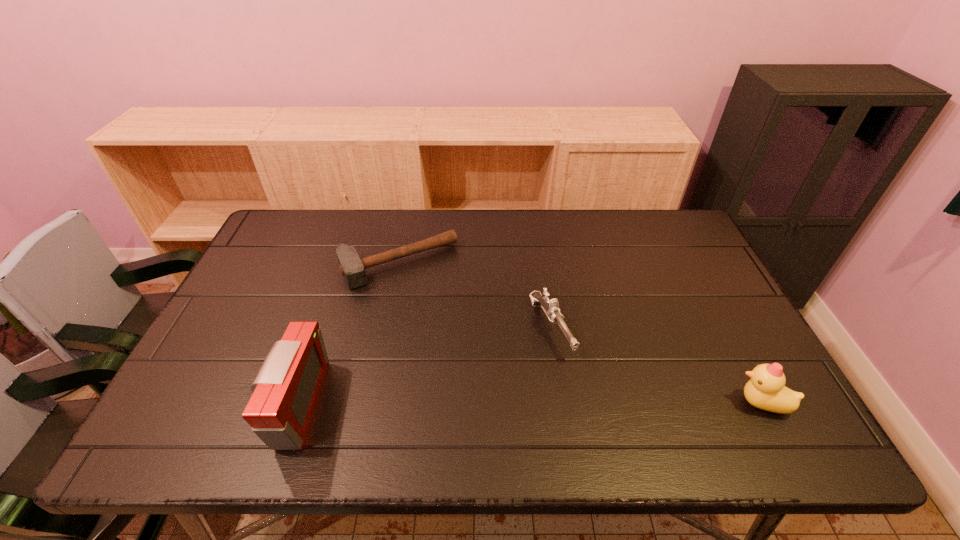
Identify the location of free space that is in between the camera and the third tallest object. This screenshot has width=960, height=540. (424, 366).

You are a GUI agent. You are given a task and a screenshot of the screen. Output one action in this format:
    pyautogui.click(x=<x>, y=<y>)
    Task: Click on the unoccupied area between the third tallest object and the camera
    
    Given the screenshot: What is the action you would take?
    pyautogui.click(x=424, y=366)

At what (x,y) coordinates should I click in order to perform the action: click on vacant area between the farthest object and the second object from right to left. Please return your answer as a coordinate pair (x, y). Looking at the image, I should click on (x=475, y=296).

Identify the location of free space between the camera and the rightmost object. The height and width of the screenshot is (540, 960). (530, 403).

Identify the location of vacant space in between the duckling and the farthest object. [x=581, y=334].

The height and width of the screenshot is (540, 960). I want to click on free space between the second shortest object and the duckling, so click(656, 366).

You are a GUI agent. You are given a task and a screenshot of the screen. Output one action in this format:
    pyautogui.click(x=<x>, y=<y>)
    Task: Click on the empty location between the rightmost object and the camera
    This screenshot has height=540, width=960.
    Given the screenshot: What is the action you would take?
    pyautogui.click(x=530, y=403)

Point out which object is positioned as the third nearest to the second object from right to left. Please provide its 2D coordinates. Your answer should be formatted as a tuple, i.e. [(x, y)], where the tuple contains the x and y coordinates of a point satisfying the conditions above.

[(286, 390)]

Identify which object is located as the nearest to the second object from right to left. Please provide its 2D coordinates. Your answer should be formatted as a tuple, i.e. [(x, y)], where the tuple contains the x and y coordinates of a point satisfying the conditions above.

[(351, 266)]

Find the location of a particular element. The height and width of the screenshot is (540, 960). free space in the image that satisfies the following two spatial constraints: 1. on the front side of the third shortest object; 2. on the front-facing side of the gun is located at coordinates (x=562, y=403).